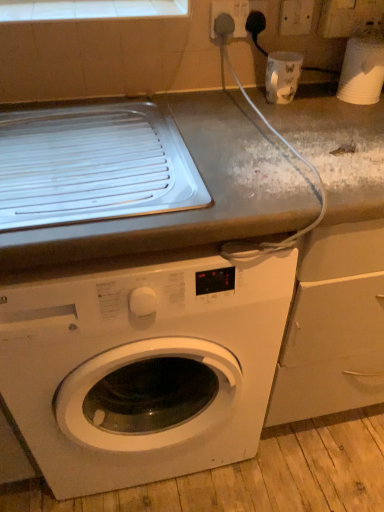
You are a GUI agent. You are given a task and a screenshot of the screen. Output one action in this format:
    pyautogui.click(x=<x>, y=<y>)
    Task: Click on the free space in front of white plastic cup at upper right, the 2th appliance in the left-to-right sequence
    
    Given the screenshot: What is the action you would take?
    pyautogui.click(x=351, y=120)